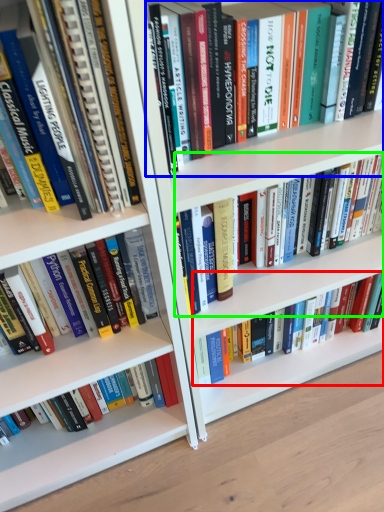
Question: Based on their relative distances, which object is farther from book (highlighted by a red box)? Choose from book (highlighted by a blue box) and book (highlighted by a green box).

Choices:
 (A) book
 (B) book

Answer: (A)